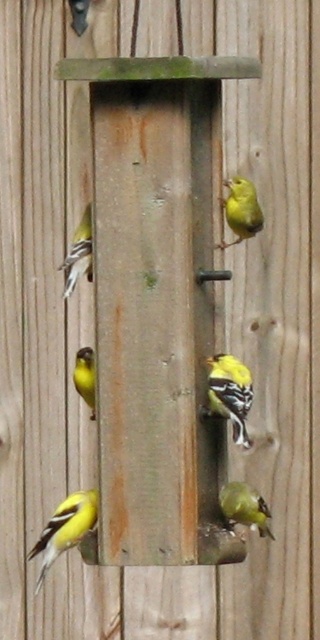
You are observing two yellow matte birds on a wooden bird feeder. The birds are labeled as the yellow matte bird at center and the yellow matte bird at lower center. Which bird is located to the left of the other?

The yellow matte bird at center is positioned on the left side of the yellow matte bird at lower center.

You are an ornithologist observing two birds on a wooden bird feeder. You notice a yellow matte bird at center and a matte yellow bird at center. Which of these two birds is taller?

The yellow matte bird at center is taller than the matte yellow bird at center.